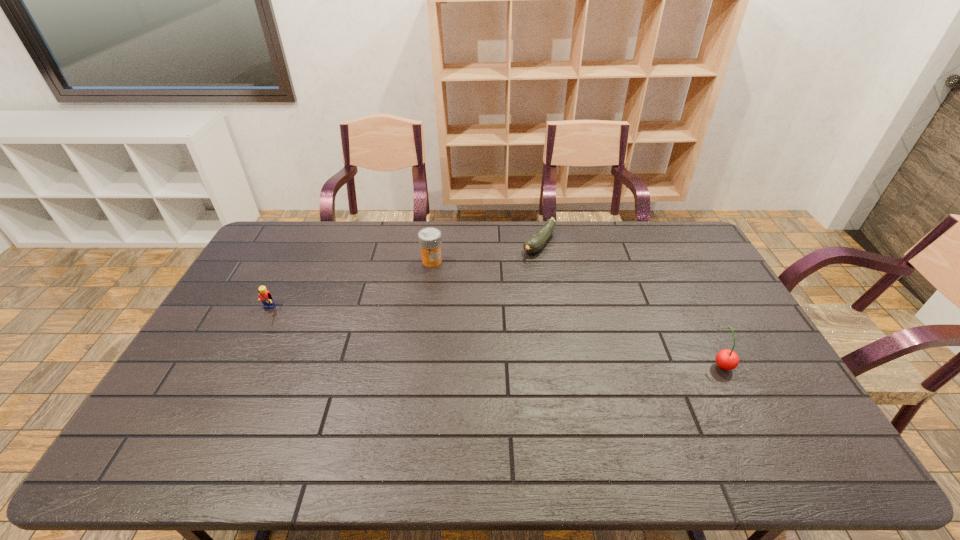
Identify the location of vacant space at the near edge. (300, 415).

In the image, there is a desktop. Where is `free region at the left edge`? free region at the left edge is located at coordinates (199, 383).

Where is `free location at the right edge of the desktop`? This screenshot has height=540, width=960. free location at the right edge of the desktop is located at coordinates (721, 314).

At what (x,y) coordinates should I click in order to perform the action: click on vacant region at the far left corner of the desktop. Please return your answer as a coordinate pair (x, y). Image resolution: width=960 pixels, height=540 pixels. Looking at the image, I should click on (276, 228).

The image size is (960, 540). Identify the location of vacant space at the near left corner of the desktop. (176, 399).

Where is `empty location between the cherry and the third farthest object`? The width and height of the screenshot is (960, 540). empty location between the cherry and the third farthest object is located at coordinates (494, 338).

This screenshot has height=540, width=960. In order to click on free area in between the shortest object and the leftmost object in this screenshot , I will do `click(403, 278)`.

Image resolution: width=960 pixels, height=540 pixels. Find the location of `vacant region between the leftmost object and the medicine`. vacant region between the leftmost object and the medicine is located at coordinates (349, 286).

The height and width of the screenshot is (540, 960). Find the location of `free space between the third object from right to left and the nearest object`. free space between the third object from right to left and the nearest object is located at coordinates (577, 313).

What are the coordinates of `free area in between the medicine and the shortest object` in the screenshot? It's located at (486, 252).